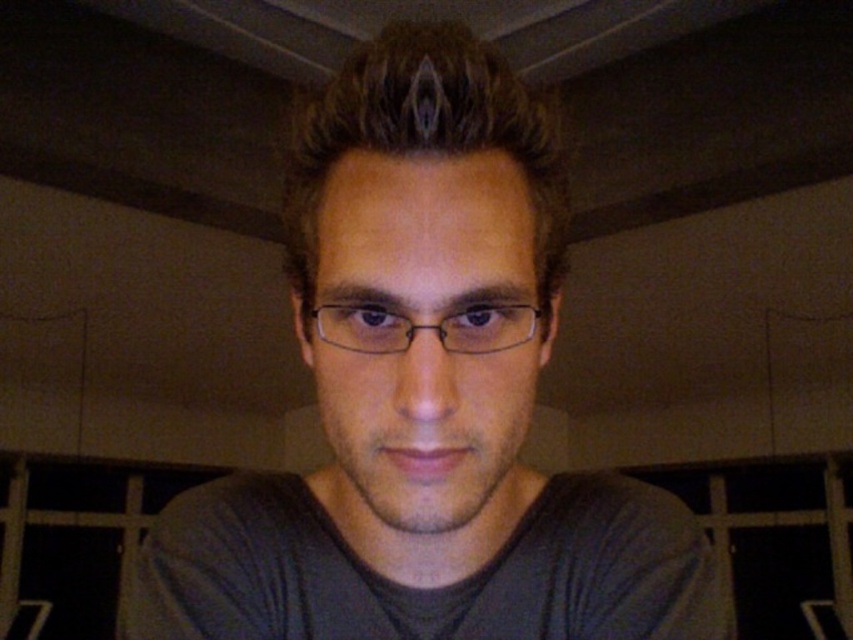
You are a photographer setting up a portrait shoot. You have a backdrop that is 1.2 meters wide. You need to decide whether the gray matte shirt at center and the clear plastic glasses at center can fit side by side on this backdrop without overlapping. Can they fit?

The gray matte shirt at center might be wider than clear plastic glasses at center, so their combined width could exceed the 1.2 meter backdrop. It is uncertain if they will fit without overlapping.

You are a photographer adjusting your camera settings to capture a portrait. You need to ensure the gray matte shirt at center is in focus. What is the minimum distance the camera should be from the subject to achieve sharp focus?

The gray matte shirt at center is positioned 28.14 centimeters away from the camera. To ensure it is in focus, the camera should be at least 28.14 centimeters away from the subject.

You are a photographer adjusting the lighting for a portrait. You notice the subject has brown matte hair at center and clear plastic glasses at center. Which object is located higher on the subject?

The brown matte hair at center is positioned over clear plastic glasses at center, so it is higher.